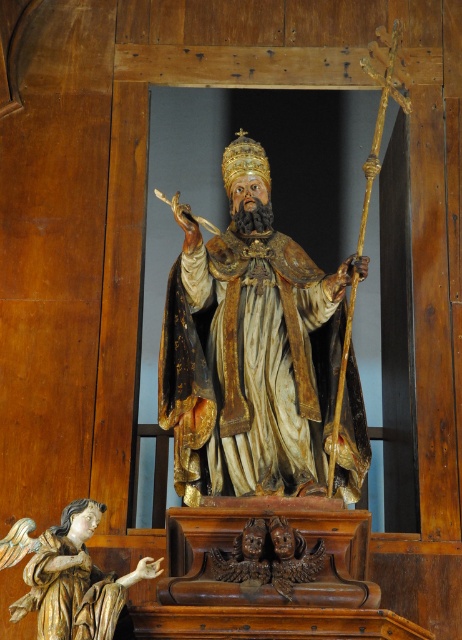
Between wooden statue at center and wooden angel at lower left, which one appears on the left side from the viewer's perspective?

wooden angel at lower left

Can you confirm if wooden statue at center is thinner than wooden angel at lower left?

No, wooden statue at center is not thinner than wooden angel at lower left.

Is point (281, 307) more distant than point (81, 524)?

Yes.

In order to click on wooden statue at center in this screenshot , I will do click(249, 348).